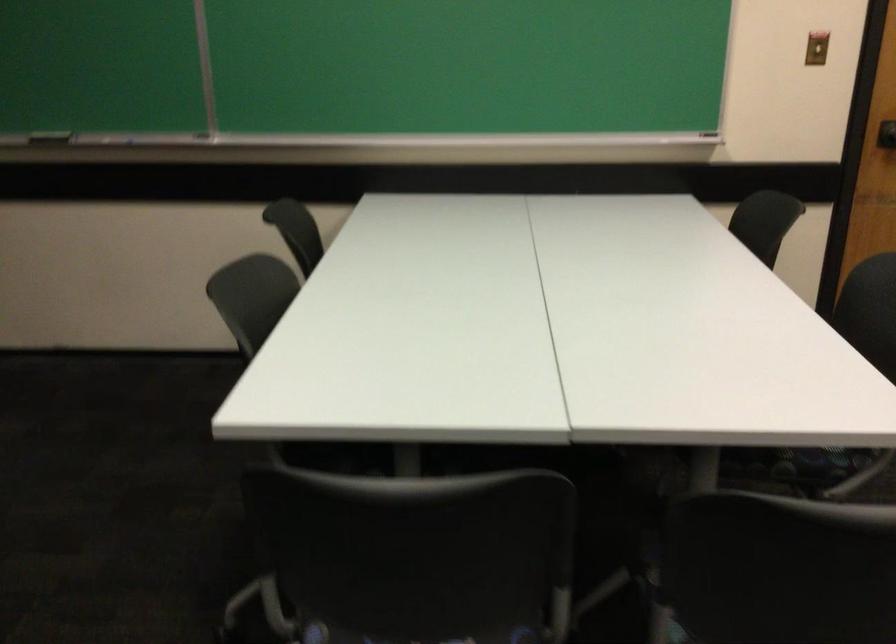
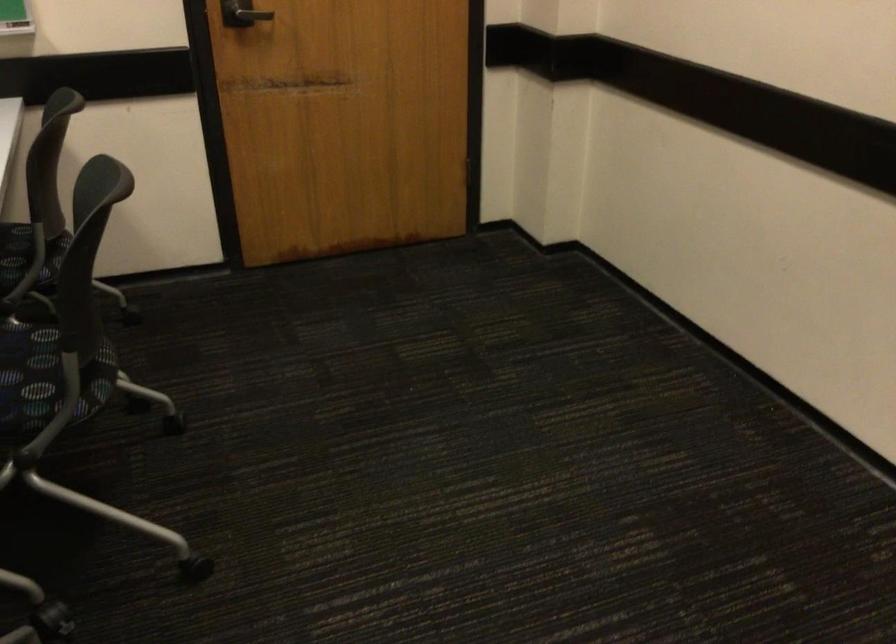
Question: Which direction would the cameraman need to move to produce the second image? Reply with the corresponding letter.

Choices:
 (A) Left
 (B) Right
 (C) Forward
 (D) Backward

Answer: (B)